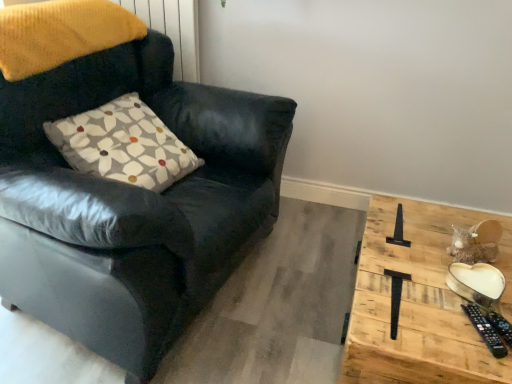
Describe the element at coordinates (132, 203) in the screenshot. The height and width of the screenshot is (384, 512). I see `matte black armchair at left` at that location.

Find the location of `matte black armchair at left`. matte black armchair at left is located at coordinates (132, 203).

Is wooden heart-shaped plate at right at the back of matte black armchair at left?

matte black armchair at left is not turned away from wooden heart-shaped plate at right.

From a real-world perspective, is matte black armchair at left physically located above or below wooden heart-shaped plate at right?

matte black armchair at left is situated higher than wooden heart-shaped plate at right in the real world.

Is matte black armchair at left to the right of wooden heart-shaped plate at right from the viewer's perspective?

Incorrect, matte black armchair at left is not on the right side of wooden heart-shaped plate at right.

Does matte black armchair at left have a greater height compared to wooden heart-shaped plate at right?

Correct, matte black armchair at left is much taller as wooden heart-shaped plate at right.

Which is more to the right, wooden heart-shaped plate at right or matte black armchair at left?

From the viewer's perspective, wooden heart-shaped plate at right appears more on the right side.

Between wooden heart-shaped plate at right and matte black armchair at left, which one has more height?

matte black armchair at left.

Is wooden heart-shaped plate at right oriented towards matte black armchair at left?

No, wooden heart-shaped plate at right is not oriented towards matte black armchair at left.

Is point (434, 223) less distant than point (290, 114)?

Yes.

Who is bigger, wooden heart-shaped plate at right or white printed cushion at upper left?

wooden heart-shaped plate at right.

Is wooden heart-shaped plate at right facing away from white printed cushion at upper left?

No, white printed cushion at upper left is not at the back of wooden heart-shaped plate at right.

Does wooden heart-shaped plate at right have a greater width compared to white printed cushion at upper left?

Indeed, wooden heart-shaped plate at right has a greater width compared to white printed cushion at upper left.

The width and height of the screenshot is (512, 384). I want to click on table that appears below the white printed cushion at upper left (from a real-world perspective), so click(x=419, y=302).

From a real-world perspective, relative to wooden heart-shaped plate at right, is white printed cushion at upper left vertically above or below?

white printed cushion at upper left is above wooden heart-shaped plate at right.

Based on the photo, would you say white printed cushion at upper left is to the left or to the right of wooden heart-shaped plate at right in the picture?

white printed cushion at upper left is positioned on wooden heart-shaped plate at right's left side.

Between white printed cushion at upper left and wooden heart-shaped plate at right, which one has smaller size?

With smaller size is white printed cushion at upper left.

Between white printed cushion at upper left and matte black armchair at left, which one has smaller width?

Thinner between the two is white printed cushion at upper left.

How many degrees apart are the facing directions of white printed cushion at upper left and matte black armchair at left?

They differ by 3.29 degrees in their facing directions.

Is white printed cushion at upper left oriented away from matte black armchair at left?

Yes.

Which object is positioned more to the left, white printed cushion at upper left or matte black armchair at left?

matte black armchair at left is more to the left.

Looking at this image, how distant is matte black armchair at left from white printed cushion at upper left?

matte black armchair at left is 8.28 inches away from white printed cushion at upper left.

Considering the sizes of objects matte black armchair at left and white printed cushion at upper left in the image provided, who is shorter, matte black armchair at left or white printed cushion at upper left?

white printed cushion at upper left is shorter.

Does matte black armchair at left turn towards white printed cushion at upper left?

Yes, matte black armchair at left is aimed at white printed cushion at upper left.

Between matte black armchair at left and white printed cushion at upper left, which one appears on the left side from the viewer's perspective?

From the viewer's perspective, matte black armchair at left appears more on the left side.

The width and height of the screenshot is (512, 384). Identify the location of chair that is in front of the wooden heart-shaped plate at right. (132, 203).

Locate an element on the screen. Image resolution: width=512 pixels, height=384 pixels. table behind the matte black armchair at left is located at coordinates (419, 302).

Looking at the image, which one is located further to matte black armchair at left, white printed cushion at upper left or wooden heart-shaped plate at right?

Based on the image, wooden heart-shaped plate at right appears to be further to matte black armchair at left.

When comparing their distances from wooden heart-shaped plate at right, does matte black armchair at left or white printed cushion at upper left seem closer?

matte black armchair at left is positioned closer to the anchor wooden heart-shaped plate at right.

Estimate the real-world distances between objects in this image. Which object is further from matte black armchair at left, wooden heart-shaped plate at right or white printed cushion at upper left?

Among the two, wooden heart-shaped plate at right is located further to matte black armchair at left.

When comparing their distances from white printed cushion at upper left, does matte black armchair at left or wooden heart-shaped plate at right seem further?

Among the two, wooden heart-shaped plate at right is located further to white printed cushion at upper left.

Based on their spatial positions, is wooden heart-shaped plate at right or matte black armchair at left further from white printed cushion at upper left?

wooden heart-shaped plate at right lies further to white printed cushion at upper left than the other object.

Considering their positions, is white printed cushion at upper left positioned further to wooden heart-shaped plate at right than matte black armchair at left?

Among the two, white printed cushion at upper left is located further to wooden heart-shaped plate at right.

The height and width of the screenshot is (384, 512). In order to click on pillow between matte black armchair at left and wooden heart-shaped plate at right in this screenshot , I will do `click(123, 144)`.